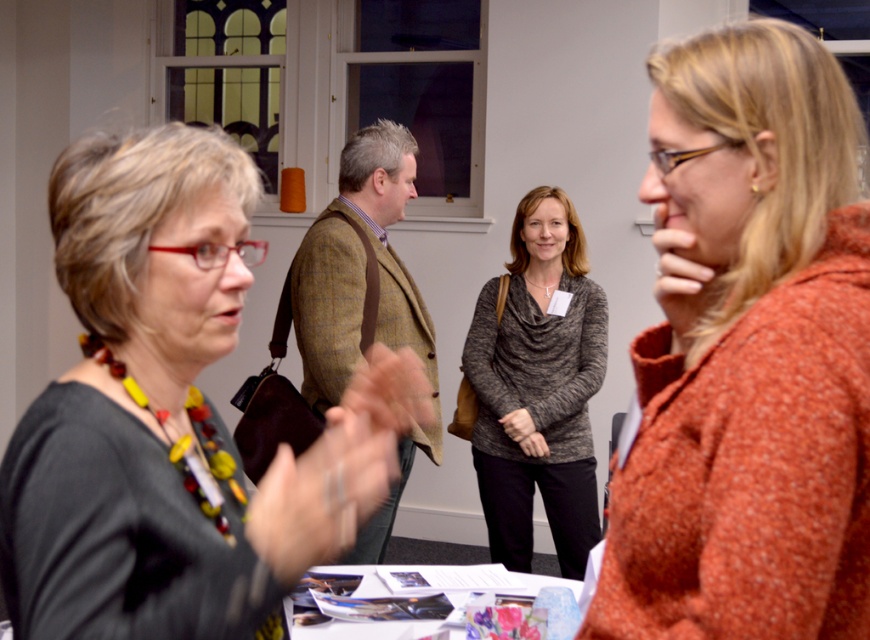
Question: Which point is farther to the camera?

Choices:
 (A) orange speckled sweater at right
 (B) white paper at center

Answer: (B)

Question: Which point appears farthest from the camera in this image?

Choices:
 (A) (851, 333)
 (B) (440, 577)
 (C) (490, 385)

Answer: (C)

Question: Can you confirm if knit sweater at center is positioned to the right of white paper at center?

Choices:
 (A) yes
 (B) no

Answer: (A)

Question: Which point is farther to the camera?

Choices:
 (A) matte black sweater at center
 (B) orange speckled sweater at right
 (C) knit sweater at center
 (D) white paper at center

Answer: (C)

Question: Is orange speckled sweater at right behind knit sweater at center?

Choices:
 (A) yes
 (B) no

Answer: (B)

Question: Is matte black sweater at center positioned in front of knit sweater at center?

Choices:
 (A) no
 (B) yes

Answer: (B)